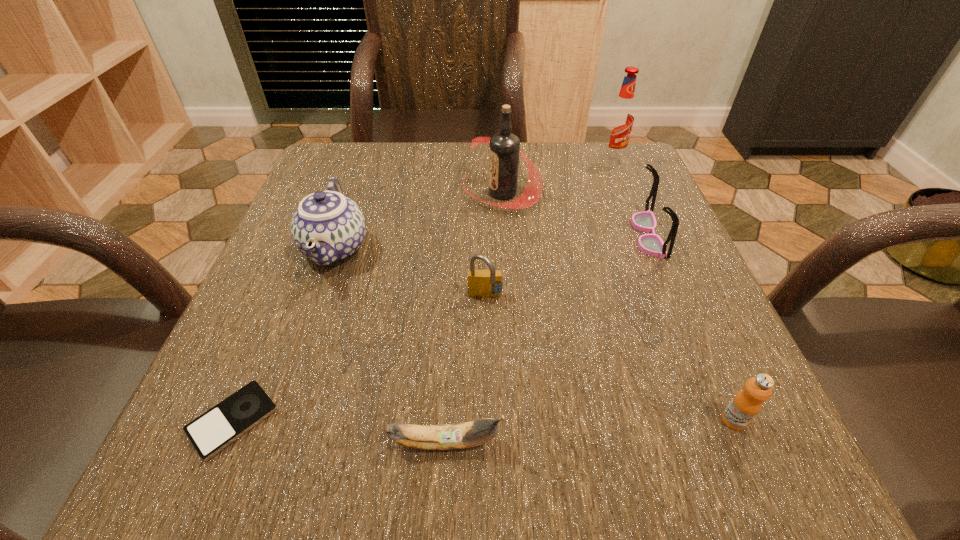
This screenshot has height=540, width=960. Find the location of `vacant area at the near edge of the desktop`. vacant area at the near edge of the desktop is located at coordinates (557, 454).

Identify the location of vacant area at the left edge of the desktop. (246, 370).

In the image, there is a desktop. At what (x,y) coordinates should I click in order to perform the action: click on vacant space at the right edge. Please return your answer as a coordinate pair (x, y). Looking at the image, I should click on (768, 407).

The height and width of the screenshot is (540, 960). Find the location of `vacant space at the far left corner of the desktop`. vacant space at the far left corner of the desktop is located at coordinates (387, 141).

The height and width of the screenshot is (540, 960). In the image, there is a desktop. In order to click on blank space at the near left corner in this screenshot , I will do `click(250, 463)`.

Locate an element on the screen. blank space at the far right corner of the desktop is located at coordinates (598, 154).

Image resolution: width=960 pixels, height=540 pixels. In the image, there is a desktop. Identify the location of vacant space at the near right corner. (748, 463).

The width and height of the screenshot is (960, 540). What are the coordinates of `blank region between the chinaware and the second shortest object` in the screenshot? It's located at (390, 346).

You are a GUI agent. You are given a task and a screenshot of the screen. Output one action in this format:
    pyautogui.click(x=<x>, y=<y>)
    Task: Click on the unoccupied position between the seventh tallest object and the chinaware
    This screenshot has width=960, height=540.
    Given the screenshot: What is the action you would take?
    pyautogui.click(x=390, y=346)

Where is `free spot between the farther root beer and the second shortest object`? The image size is (960, 540). free spot between the farther root beer and the second shortest object is located at coordinates (528, 301).